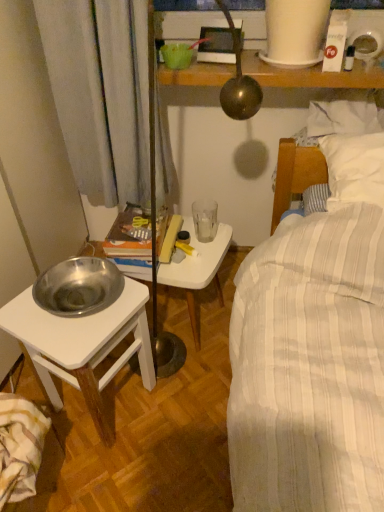
This screenshot has height=512, width=384. What are the coordinates of `free space above silver metallic bowl at left (from a real-world perspective)` in the screenshot? It's located at (76, 310).